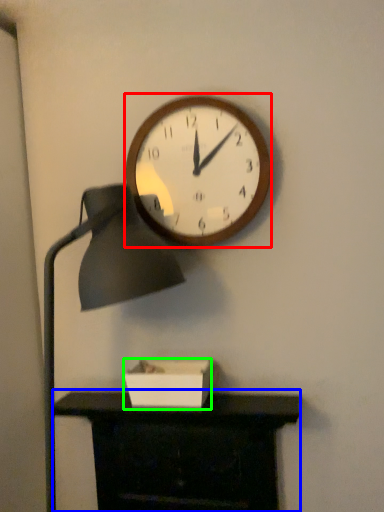
Question: Based on their relative distances, which object is farther from wall clock (highlighted by a red box)? Choose from furniture (highlighted by a blue box) and box (highlighted by a green box).

Choices:
 (A) furniture
 (B) box

Answer: (A)